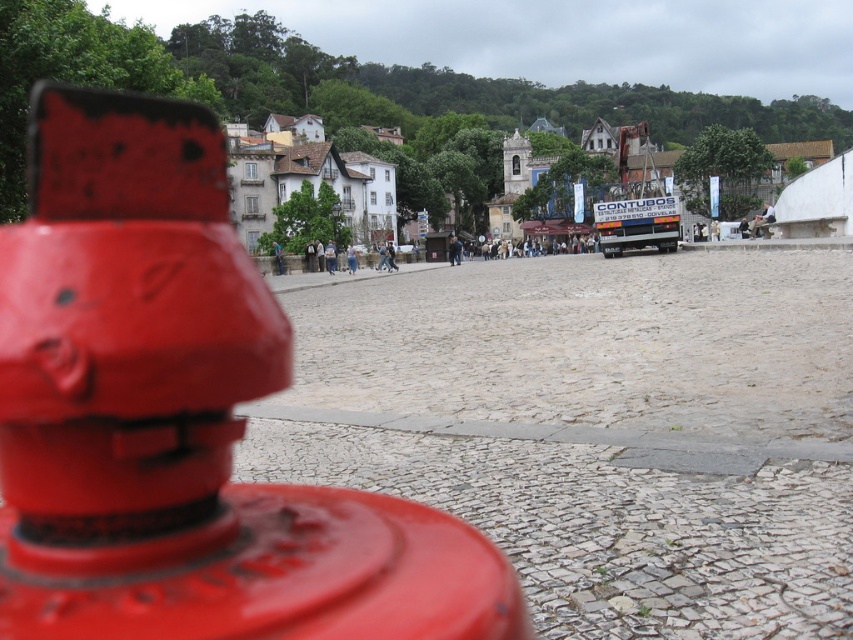
Question: Can you confirm if matte red hydrant at center is positioned below white stone buildings at center?

Choices:
 (A) no
 (B) yes

Answer: (B)

Question: Is the position of matte red hydrant at center less distant than that of white stone buildings at center?

Choices:
 (A) no
 (B) yes

Answer: (B)

Question: Among these points, which one is farthest from the camera?

Choices:
 (A) (379, 220)
 (B) (48, 278)

Answer: (A)

Question: Which of the following is the closest to the observer?

Choices:
 (A) (276, 145)
 (B) (461, 570)

Answer: (B)

Question: Does matte red hydrant at center appear under white stone buildings at center?

Choices:
 (A) yes
 (B) no

Answer: (A)